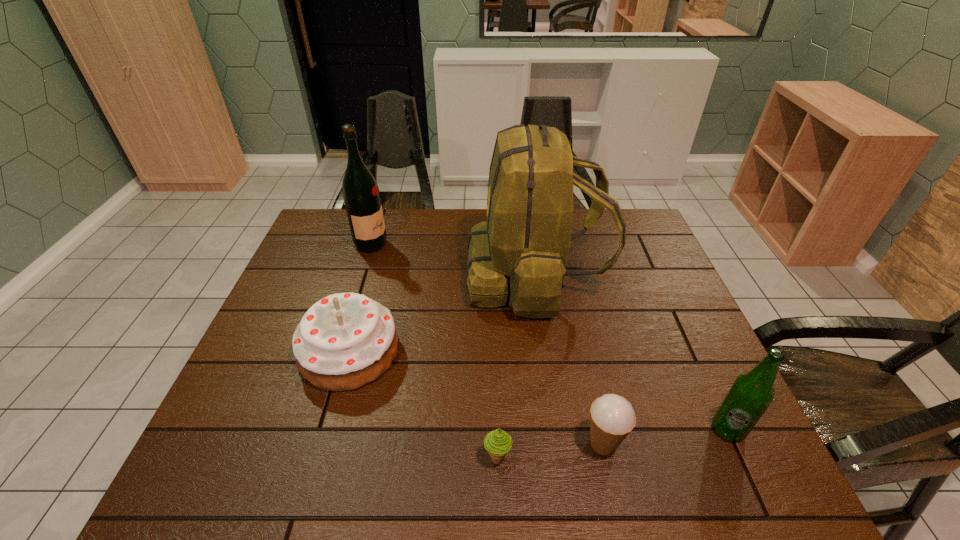
I want to click on blank space located 0.390m on the front-facing side of the backpack, so click(336, 276).

Find the location of `vacant space located on the front-facing side of the liquor`. vacant space located on the front-facing side of the liquor is located at coordinates (444, 245).

I want to click on vacant position located 0.080m on the label of the beer bottle, so click(x=753, y=483).

Where is `free region located on the back of the cake`? This screenshot has width=960, height=540. free region located on the back of the cake is located at coordinates (383, 233).

At what (x,y) coordinates should I click in order to perform the action: click on vacant space positioned 0.160m on the right of the right icecream. Please return your answer as a coordinate pair (x, y). The width and height of the screenshot is (960, 540). Looking at the image, I should click on (700, 444).

The height and width of the screenshot is (540, 960). Identify the location of free location located on the right of the shortest object. (688, 457).

At what (x,y) coordinates should I click in order to perform the action: click on backpack at the far edge. Please return your answer as a coordinate pair (x, y). The height and width of the screenshot is (540, 960). Looking at the image, I should click on (521, 251).

Image resolution: width=960 pixels, height=540 pixels. I want to click on liquor that is at the far edge, so click(361, 195).

You are a GUI agent. You are given a task and a screenshot of the screen. Output one action in this format:
    pyautogui.click(x=<x>, y=<y>)
    Task: Click on the object situated at the left edge
    The height and width of the screenshot is (540, 960).
    Given the screenshot: What is the action you would take?
    pyautogui.click(x=345, y=341)

The height and width of the screenshot is (540, 960). Identify the location of object located in the right edge section of the desktop. (751, 394).